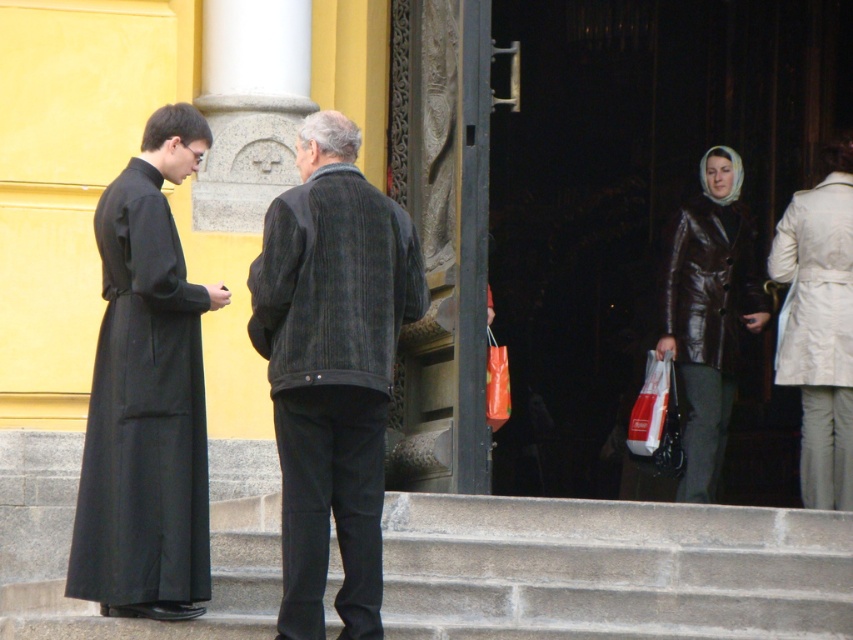
Which is above, brown leather jacket at right or brown leather coat at right?

brown leather coat at right

Who is lower down, brown leather jacket at right or brown leather coat at right?

brown leather jacket at right

Where is `brown leather jacket at right`? brown leather jacket at right is located at coordinates (709, 314).

At what (x,y) coordinates should I click in order to perform the action: click on brown leather jacket at right. Please return your answer as a coordinate pair (x, y). This screenshot has width=853, height=640. Looking at the image, I should click on (709, 314).

Between dark corduroy jacket at center and brown leather coat at right, which one has more height?

dark corduroy jacket at center

Is dark corduroy jacket at center smaller than brown leather coat at right?

No, dark corduroy jacket at center is not smaller than brown leather coat at right.

At what (x,y) coordinates should I click in order to perform the action: click on dark corduroy jacket at center. Please return your answer as a coordinate pair (x, y). The image size is (853, 640). Looking at the image, I should click on (334, 284).

Consider the image. Is matte black robe at left wider than brown leather coat at right?

Correct, the width of matte black robe at left exceeds that of brown leather coat at right.

Is point (196, 148) positioned in front of point (671, 241)?

Yes, it is in front of point (671, 241).

Does point (73, 570) come in front of point (685, 348)?

Yes.

Identify the location of matte black robe at left. The height and width of the screenshot is (640, 853). (146, 396).